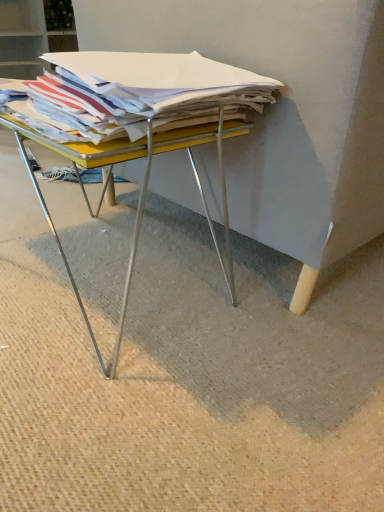
Identify the location of white paper stack at center. Image resolution: width=384 pixels, height=512 pixels. (133, 93).

Measure the distance between point (88, 102) and camera.

The depth of point (88, 102) is 24.25 inches.

Describe the element at coordinates (133, 93) in the screenshot. I see `white paper stack at center` at that location.

This screenshot has width=384, height=512. Find the location of `yellow metal desk at center`. yellow metal desk at center is located at coordinates (142, 185).

What do you see at coordinates (142, 185) in the screenshot? I see `yellow metal desk at center` at bounding box center [142, 185].

The width and height of the screenshot is (384, 512). I want to click on white paper stack at center, so click(x=133, y=93).

Considering the relative positions of yellow metal desk at center and white paper stack at center in the image provided, is yellow metal desk at center to the right of white paper stack at center from the viewer's perspective?

No.

Is yellow metal desk at center positioned in front of white paper stack at center?

No, it is behind white paper stack at center.

Does point (78, 160) appear closer or farther from the camera than point (152, 54)?

Point (78, 160).

From the image's perspective, is yellow metal desk at center located above white paper stack at center?

Incorrect, from the image's perspective, yellow metal desk at center is lower than white paper stack at center.

From a real-world perspective, who is located lower, yellow metal desk at center or white paper stack at center?

From a 3D spatial view, yellow metal desk at center is below.

In terms of width, does yellow metal desk at center look wider or thinner when compared to white paper stack at center?

Considering their sizes, yellow metal desk at center looks broader than white paper stack at center.

Who is shorter, yellow metal desk at center or white paper stack at center?

With less height is white paper stack at center.

Which of these two, yellow metal desk at center or white paper stack at center, is smaller?

Smaller between the two is white paper stack at center.

Does yellow metal desk at center contain white paper stack at center?

No.

Is yellow metal desk at center beside white paper stack at center?

yellow metal desk at center and white paper stack at center are clearly separated.

Consider the image. Is yellow metal desk at center oriented away from white paper stack at center?

No, yellow metal desk at center is not facing the opposite direction of white paper stack at center.

How many degrees apart are the facing directions of yellow metal desk at center and white paper stack at center?

0.826 degrees separate the facing orientations of yellow metal desk at center and white paper stack at center.

You are a GUI agent. You are given a task and a screenshot of the screen. Output one action in this format:
    pyautogui.click(x=<x>, y=<y>)
    Task: Click on the desk behind the white paper stack at center
    The height and width of the screenshot is (512, 384).
    Given the screenshot: What is the action you would take?
    pyautogui.click(x=142, y=185)

Which object is positioned more to the right, white paper stack at center or yellow metal desk at center?

white paper stack at center.

Which object is further away from the camera, white paper stack at center or yellow metal desk at center?

yellow metal desk at center is more distant.

Does point (57, 139) come farther from viewer compared to point (8, 120)?

No, (57, 139) is in front of (8, 120).

In the scene shown: From the image's perspective, who appears lower, white paper stack at center or yellow metal desk at center?

yellow metal desk at center is shown below in the image.

From a real-world perspective, who is located higher, white paper stack at center or yellow metal desk at center?

white paper stack at center, from a real-world perspective.

Does white paper stack at center have a lesser width compared to yellow metal desk at center?

Yes.

Considering the sizes of objects white paper stack at center and yellow metal desk at center in the image provided, who is taller, white paper stack at center or yellow metal desk at center?

Standing taller between the two is yellow metal desk at center.

Does white paper stack at center have a larger size compared to yellow metal desk at center?

No.

Could yellow metal desk at center be considered to be inside white paper stack at center?

Definitely not — yellow metal desk at center is not inside white paper stack at center.

Is white paper stack at center with yellow metal desk at center?

No, white paper stack at center is not beside yellow metal desk at center.

Is white paper stack at center aimed at yellow metal desk at center?

No, white paper stack at center is not oriented towards yellow metal desk at center.

How far apart are white paper stack at center and yellow metal desk at center?

white paper stack at center is 4.75 inches from yellow metal desk at center.

Locate an element on the screen. magazine in front of the yellow metal desk at center is located at coordinates (133, 93).

I want to click on magazine that appears on the right of yellow metal desk at center, so click(x=133, y=93).

At what (x,y) coordinates should I click in order to perform the action: click on magazine in front of the yellow metal desk at center. Please return your answer as a coordinate pair (x, y). Looking at the image, I should click on (133, 93).